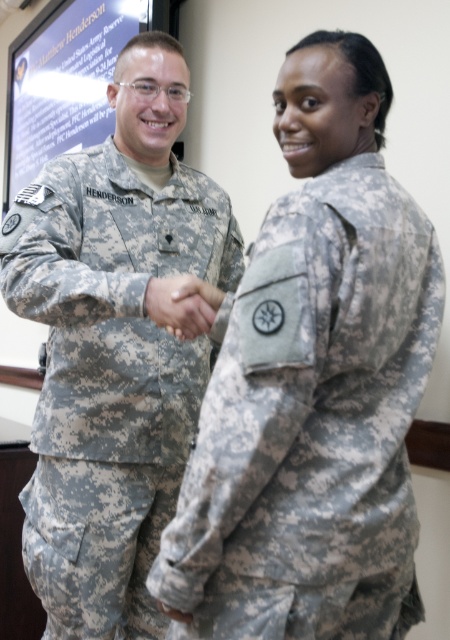
Question: Which object is positioned farthest from the camouflage fabric hand at center?

Choices:
 (A) camouflage uniform at left
 (B) camouflage uniform at center

Answer: (B)

Question: Which of the following is the closest to the observer?

Choices:
 (A) (181, 294)
 (B) (46, 272)

Answer: (A)

Question: Considering the relative positions of camouflage uniform at left and camouflage fabric hand at center in the image provided, where is camouflage uniform at left located with respect to camouflage fabric hand at center?

Choices:
 (A) below
 (B) above

Answer: (A)

Question: Does camouflage uniform at center appear over camouflage uniform at left?

Choices:
 (A) yes
 (B) no

Answer: (B)

Question: Considering the real-world distances, which object is farthest from the camouflage uniform at center?

Choices:
 (A) camouflage uniform at left
 (B) camouflage fabric hand at center

Answer: (A)

Question: Does camouflage uniform at left appear over camouflage fabric hand at center?

Choices:
 (A) yes
 (B) no

Answer: (B)